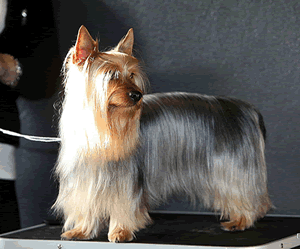
You are a GUI agent. You are given a task and a screenshot of the screen. Output one action in this format:
    pyautogui.click(x=<x>, y=<y>)
    Task: Click on the black table
    This screenshot has height=250, width=300.
    Given the screenshot: What is the action you would take?
    pyautogui.click(x=197, y=238)